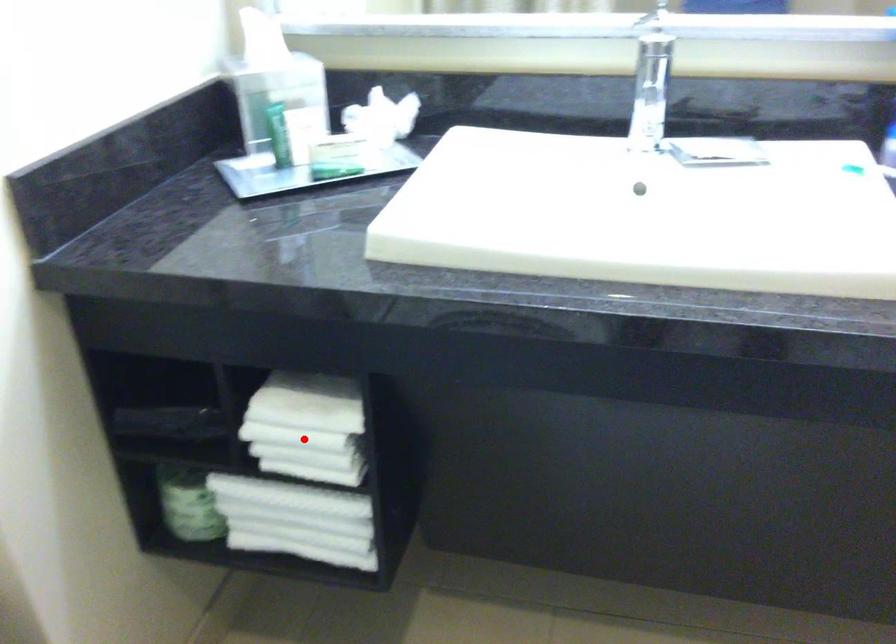
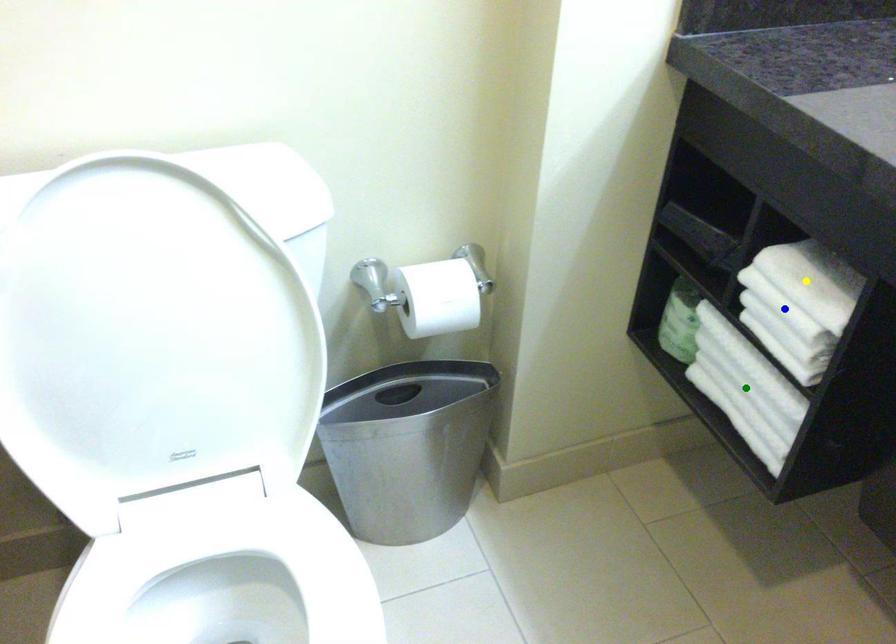
Question: I am providing you with two images of the same scene from different viewpoints. A red point is marked on the first image. You are given multiple points on the second image. Which spot in image 2 lines up with the point in image 1?

Choices:
 (A) blue point
 (B) yellow point
 (C) green point

Answer: (A)